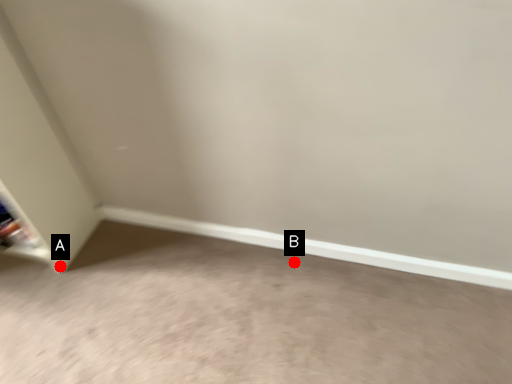
Question: Two points are circled on the image, labeled by A and B beside each circle. Which point appears farthest from the camera in this image?

Choices:
 (A) A is further
 (B) B is further

Answer: (A)